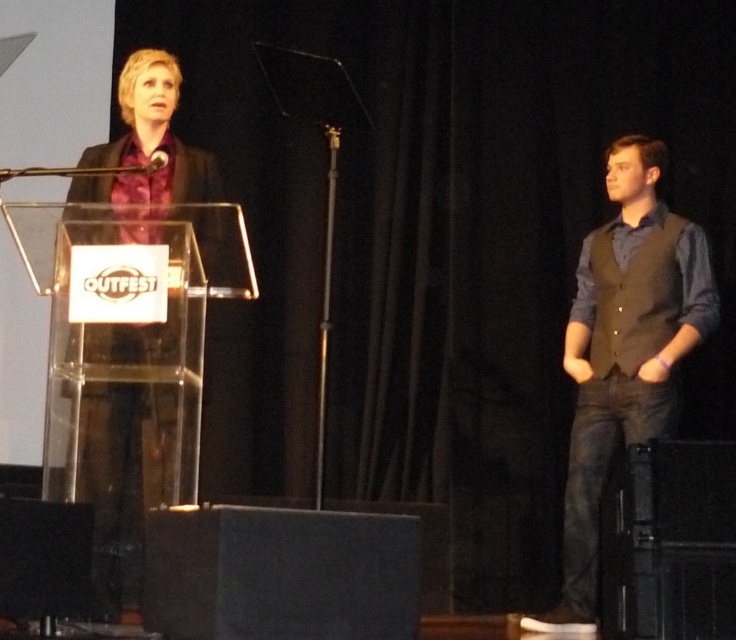
Can you confirm if dark gray vest at right is positioned below metallic silver microphone at upper center?

Yes, dark gray vest at right is below metallic silver microphone at upper center.

Describe the element at coordinates (626, 346) in the screenshot. Image resolution: width=736 pixels, height=640 pixels. I see `dark gray vest at right` at that location.

Find the location of a particular element. dark gray vest at right is located at coordinates (626, 346).